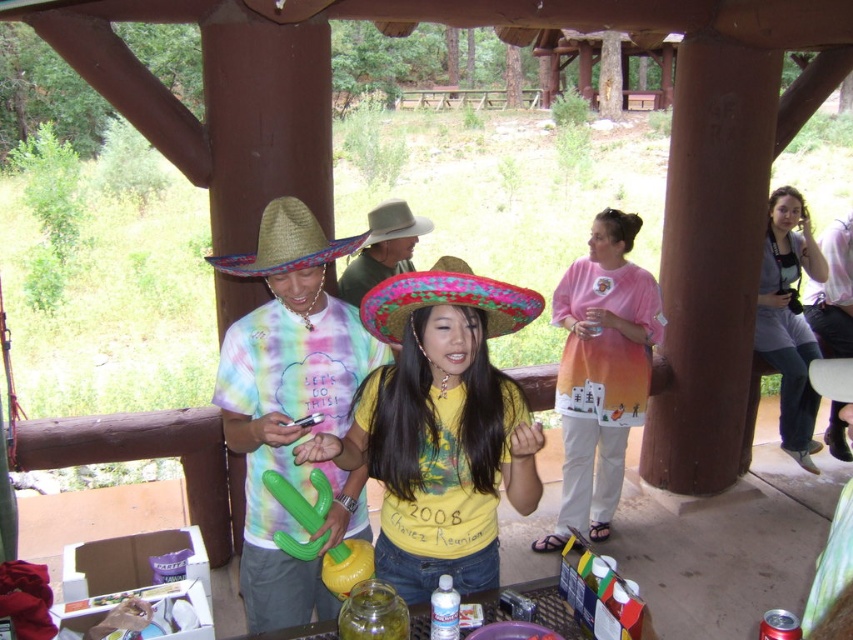
You are planning to take a photo of the matte pink shirt at center and the white felt cowboy hat at center. The camera you have can only focus on objects within 3 feet of each other. Will both items be in focus?

The matte pink shirt at center and white felt cowboy hat at center are 3.76 feet apart. Since the camera can only focus on objects within 3 feet of each other, they are slightly too far apart to be in focus together.

You are at the gathering and want to greet the person wearing the yellow matte shirt at center. Which direction should you move relative to the white felt cowboy hat at center?

You should move to the right of the white felt cowboy hat at center to greet the person wearing the yellow matte shirt at center, as the yellow matte shirt at center is positioned to the right of the white felt cowboy hat at center.

You are a photographer standing at the edge of the gathering. You want to take a photo that includes both the yellow matte shirt at center and the white felt cowboy hat at center. What is the minimum distance you need to move backward to ensure both objects are fully in frame?

The yellow matte shirt at center and white felt cowboy hat at center are 1.02 meters apart. To capture both in the frame, you need to move back enough so that the camera can encompass 1.02 meters between them. The exact distance depends on your camera lens, but generally, ensuring a few meters back would work.